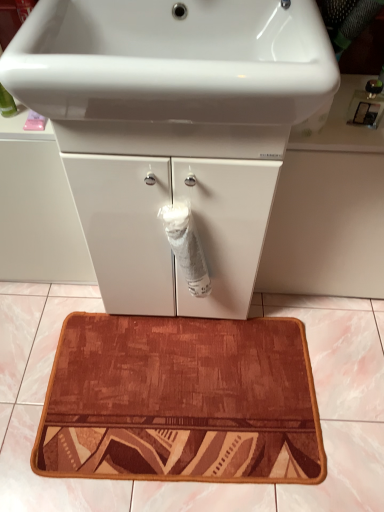
Question: In terms of height, does brown textured bath mat at center look taller or shorter compared to white matte toilet paper at center?

Choices:
 (A) short
 (B) tall

Answer: (A)

Question: Is brown textured bath mat at center inside or outside of white matte toilet paper at center?

Choices:
 (A) inside
 (B) outside

Answer: (B)

Question: Which object is positioned farthest from the white glossy sink at upper center?

Choices:
 (A) white glossy cabinet at center
 (B) white matte toilet paper at center
 (C) brown textured bath mat at center

Answer: (C)

Question: Estimate the real-world distances between objects in this image. Which object is closer to the white glossy cabinet at center?

Choices:
 (A) white glossy sink at upper center
 (B) white matte toilet paper at center
 (C) brown textured bath mat at center

Answer: (A)